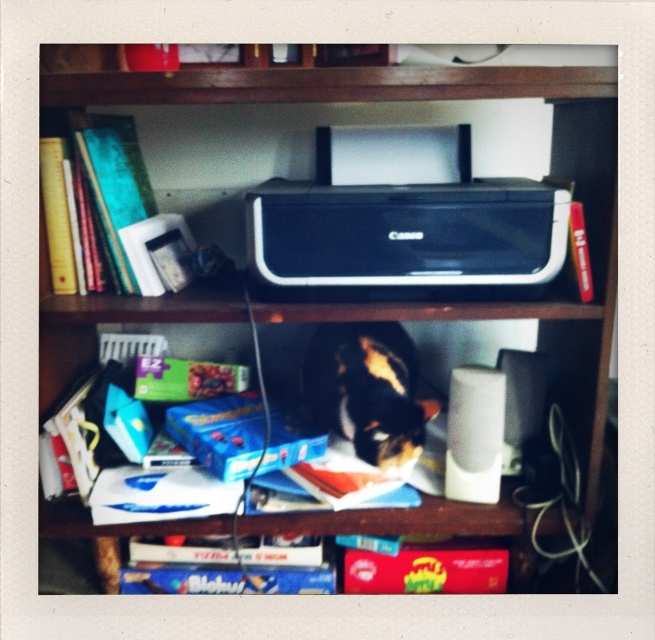
Question: Which object is closer to the camera taking this photo?

Choices:
 (A) teal matte book at upper left
 (B) red matte book at center

Answer: (A)

Question: Does teal matte book at upper left appear under matte black printer at upper center?

Choices:
 (A) yes
 (B) no

Answer: (B)

Question: Which of the following is the closest to the observer?

Choices:
 (A) (571, 228)
 (B) (369, 593)
 (C) (384, 433)
 (D) (77, 193)

Answer: (A)

Question: Is black plastic printer at center further to camera compared to red matte book at center?

Choices:
 (A) yes
 (B) no

Answer: (B)

Question: Which object is positioned closest to the calico fur cat at center?

Choices:
 (A) teal matte book at upper left
 (B) red matte book at center

Answer: (B)

Question: Is black plastic printer at center bigger than teal matte book at upper left?

Choices:
 (A) yes
 (B) no

Answer: (A)